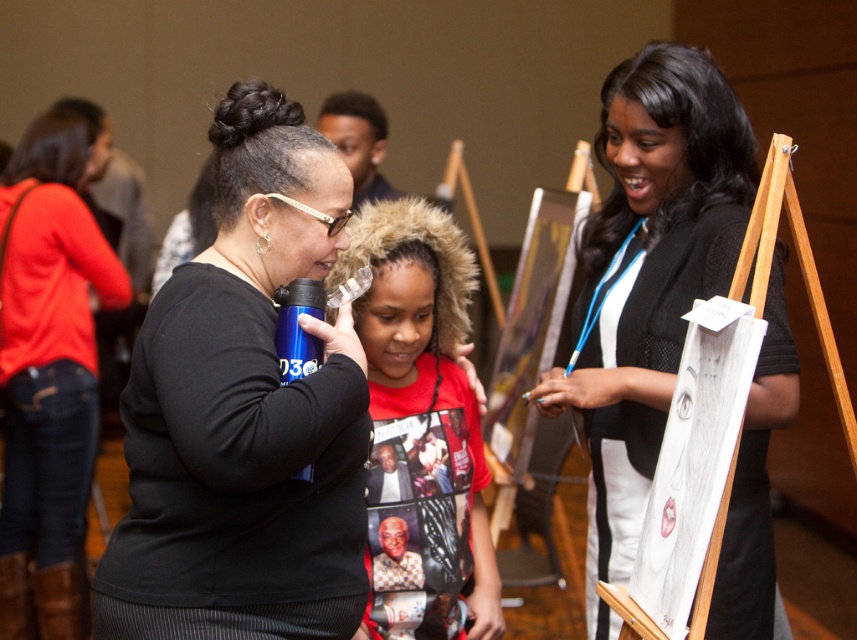
Question: Can you confirm if blue matte water bottle at center is wider than smooth black sweater at center?

Choices:
 (A) yes
 (B) no

Answer: (B)

Question: Which of these objects is positioned farthest from the matte black shirt at center?

Choices:
 (A) smooth black sweater at center
 (B) blue matte water bottle at center

Answer: (A)

Question: From the image, what is the correct spatial relationship of smooth black sweater at center in relation to matte black shirt at center?

Choices:
 (A) left
 (B) right

Answer: (B)

Question: Does blue matte water bottle at center appear under smooth black sweater at center?

Choices:
 (A) yes
 (B) no

Answer: (A)

Question: Estimate the real-world distances between objects in this image. Which object is farther from the red cotton hoodie at center?

Choices:
 (A) smooth black sweater at center
 (B) matte black shirt at center

Answer: (B)

Question: Among these points, which one is nearest to the camera?

Choices:
 (A) (370, 570)
 (B) (19, 504)
 (C) (595, 621)
 (D) (105, 595)

Answer: (D)